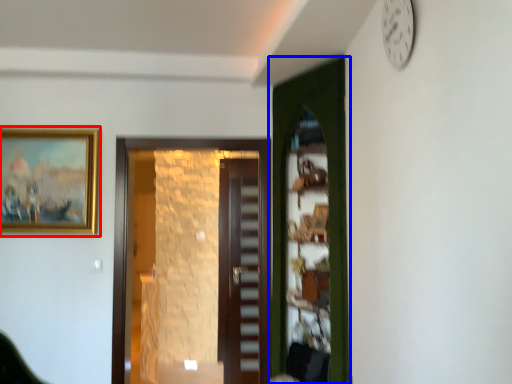
Question: Which object appears farthest to the camera in this image, picture frame (highlighted by a red box) or door (highlighted by a blue box)?

Choices:
 (A) picture frame
 (B) door

Answer: (A)